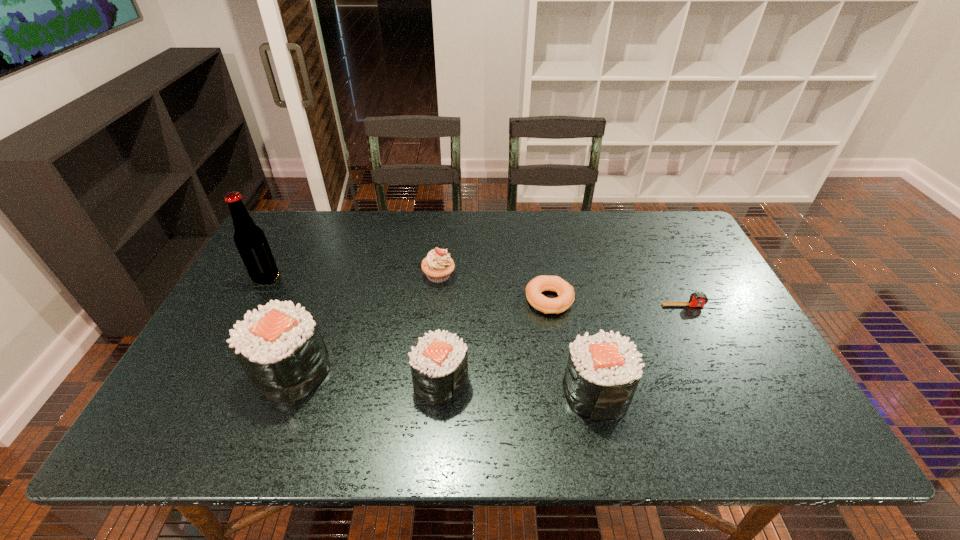
Find the location of `free space at the far edge of the desktop`. free space at the far edge of the desktop is located at coordinates (610, 243).

Locate an element on the screen. This screenshot has height=540, width=960. free space at the left edge of the desktop is located at coordinates (x=288, y=291).

I want to click on free space at the right edge of the desktop, so click(x=676, y=308).

In the image, there is a desktop. In order to click on vacant space at the far left corner in this screenshot , I will do tap(292, 224).

What are the coordinates of `free space at the far right corner of the desktop` in the screenshot? It's located at click(662, 253).

In the image, there is a desktop. At what (x,y) coordinates should I click in order to perform the action: click on vacant region at the near right corner. Please return your answer as a coordinate pair (x, y). Looking at the image, I should click on (741, 380).

Where is `free space between the bagel and the shortest sushi`? The height and width of the screenshot is (540, 960). free space between the bagel and the shortest sushi is located at coordinates (495, 341).

Find the location of a particular element. The height and width of the screenshot is (540, 960). empty space that is in between the shortest sushi and the leftmost sushi is located at coordinates (366, 376).

Find the location of `vacant space that's between the second object from left to right and the bagel`. vacant space that's between the second object from left to right and the bagel is located at coordinates (420, 336).

What are the coordinates of `free space between the second tallest sushi and the cupcake` in the screenshot? It's located at (517, 334).